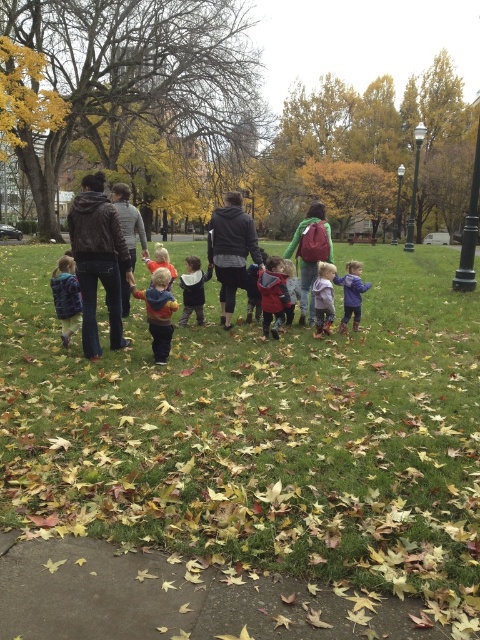
Is point (216, 580) positioned in front of point (87, 248)?

Yes, it is.

Does concrete pavement at lower left have a greater height compared to leather jacket at center?

No.

The image size is (480, 640). What do you see at coordinates (176, 600) in the screenshot? I see `concrete pavement at lower left` at bounding box center [176, 600].

Where is `concrete pavement at lower left`? This screenshot has height=640, width=480. concrete pavement at lower left is located at coordinates (176, 600).

Measure the distance between point (205,276) and camera.

8.96 meters

Does white fleece jacket at center appear on the right side of matte purple jacket at center?

Incorrect, white fleece jacket at center is not on the right side of matte purple jacket at center.

Who is more forward, (190, 298) or (312, 291)?

Positioned in front is point (312, 291).

The height and width of the screenshot is (640, 480). I want to click on white fleece jacket at center, so click(192, 289).

Is matte purple jacket at center in front of matte blue hoodie at center?

No.

Does matte purple jacket at center have a greater width compared to matte blue hoodie at center?

No, matte purple jacket at center is not wider than matte blue hoodie at center.

The width and height of the screenshot is (480, 640). Describe the element at coordinates (324, 298) in the screenshot. I see `matte purple jacket at center` at that location.

Find the location of `matte purple jacket at center`. matte purple jacket at center is located at coordinates (324, 298).